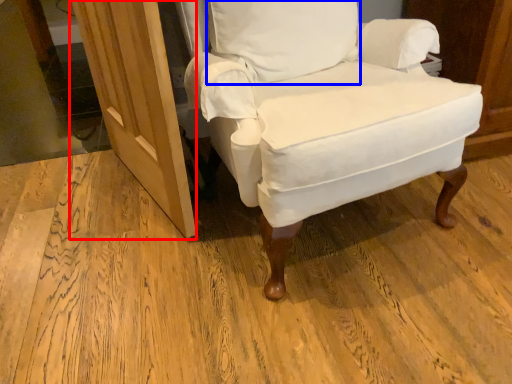
Question: Which object is closer to the camera taking this photo, screen door (highlighted by a red box) or pillow (highlighted by a blue box)?

Choices:
 (A) screen door
 (B) pillow

Answer: (A)